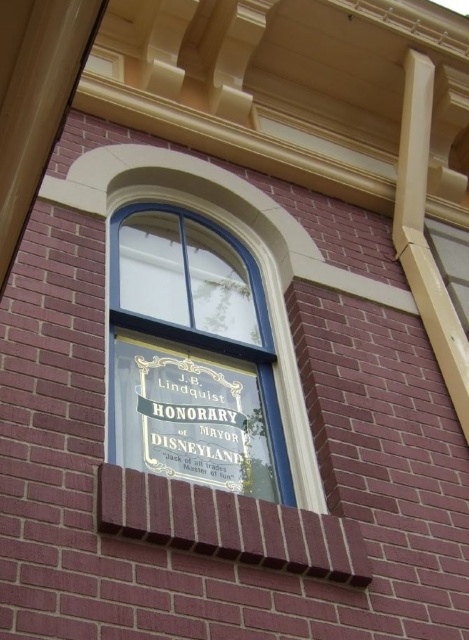
Question: Among these objects, which one is farthest from the camera?

Choices:
 (A) gold metallic plaque at center
 (B) transparent glass window at center

Answer: (B)

Question: Among these objects, which one is farthest from the camera?

Choices:
 (A) transparent glass window at center
 (B) gold metallic plaque at center

Answer: (A)

Question: Is gold metallic plaque at center behind transparent glass window at center?

Choices:
 (A) no
 (B) yes

Answer: (A)

Question: Which point is closer to the camera?

Choices:
 (A) (280, 432)
 (B) (302, 445)

Answer: (B)

Question: Is gold metallic plaque at center positioned before transparent glass window at center?

Choices:
 (A) yes
 (B) no

Answer: (A)

Question: Can you confirm if gold metallic plaque at center is wider than transparent glass window at center?

Choices:
 (A) yes
 (B) no

Answer: (A)